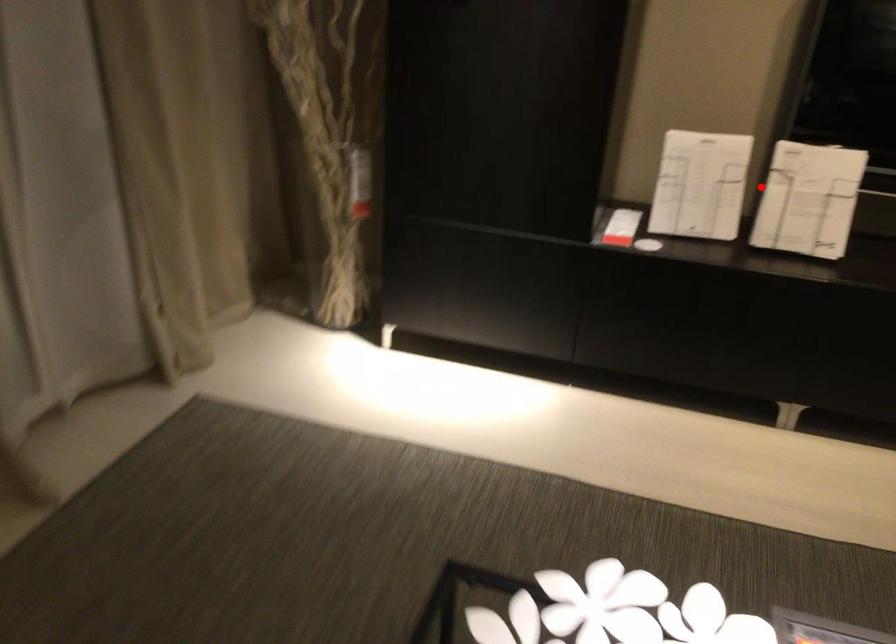
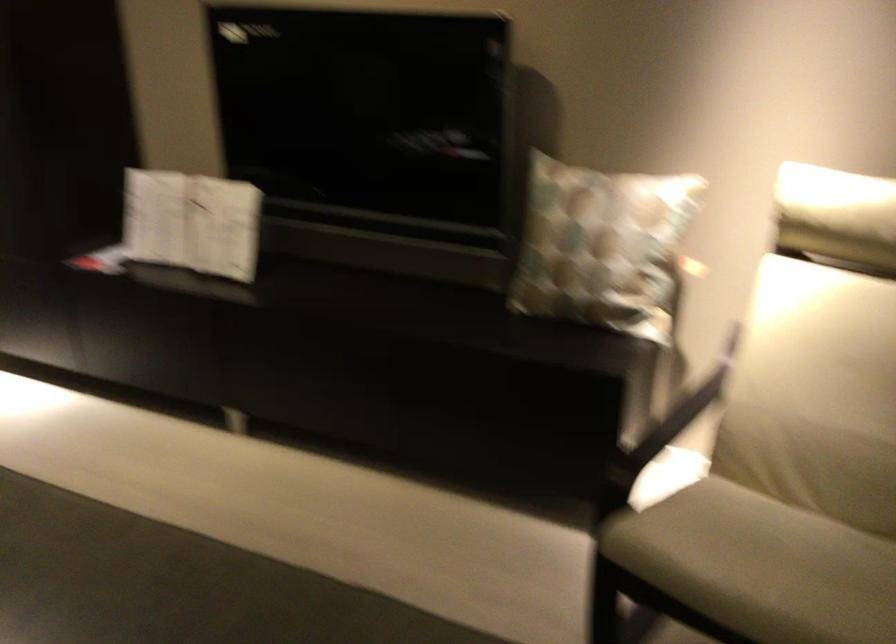
Where in the second image is the point corresponding to the highlighted location from the first image?

(192, 222)